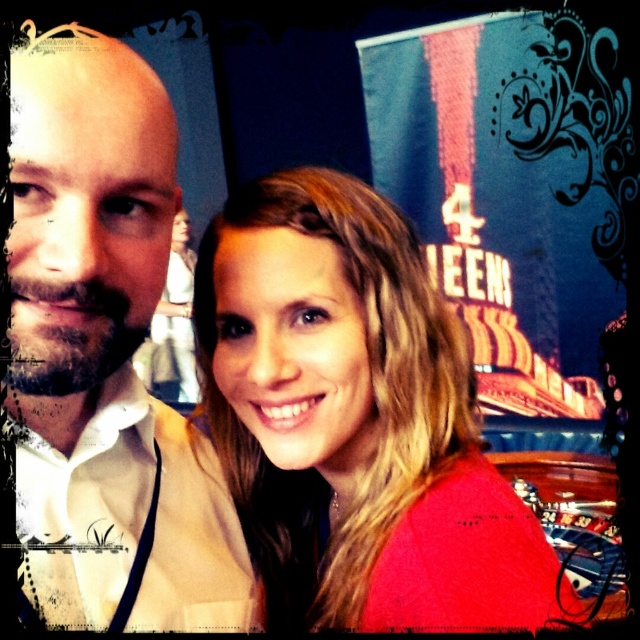
Question: Is white shirt at center smaller than smooth beige dress at center?

Choices:
 (A) yes
 (B) no

Answer: (A)

Question: Considering the real-world distances, which object is farthest from the smooth red shirt at center?

Choices:
 (A) smooth beige dress at center
 (B) white shirt at center

Answer: (A)

Question: Which of the following is the farthest from the observer?

Choices:
 (A) (166, 316)
 (B) (49, 102)
 (C) (227, 364)

Answer: (A)

Question: Does white shirt at center have a smaller size compared to smooth beige dress at center?

Choices:
 (A) yes
 (B) no

Answer: (A)

Question: Which object is closer to the camera taking this photo?

Choices:
 (A) smooth red shirt at center
 (B) white shirt at center
 (C) smooth beige dress at center

Answer: (B)

Question: Does white shirt at center appear under smooth beige dress at center?

Choices:
 (A) yes
 (B) no

Answer: (A)